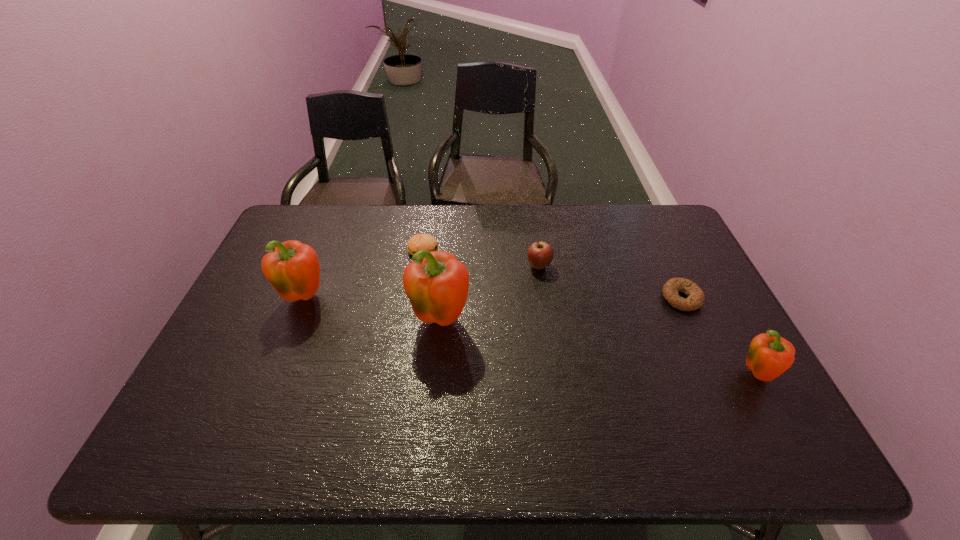
Find the location of `free area in between the second pepper from right to left and the bagel`. free area in between the second pepper from right to left and the bagel is located at coordinates (561, 309).

At what (x,y) coordinates should I click in order to perform the action: click on blank region between the shortest object and the leftmost object. Please return your answer as a coordinate pair (x, y). Looking at the image, I should click on (493, 298).

The width and height of the screenshot is (960, 540). Find the location of `vacant space that is in between the second pepper from left to right and the second tallest object`. vacant space that is in between the second pepper from left to right and the second tallest object is located at coordinates (372, 309).

The height and width of the screenshot is (540, 960). What are the coordinates of `empty space that is in between the third shortest object and the bagel` in the screenshot? It's located at (611, 282).

The image size is (960, 540). Identify the location of free space between the nearest pepper and the bagel. coord(720,337).

Select which object appears as the third closest to the bagel. Please provide its 2D coordinates. Your answer should be formatted as a tuple, i.e. [(x, y)], where the tuple contains the x and y coordinates of a point satisfying the conditions above.

[(436, 283)]

Choose which object is the nearest neighbor to the bagel. Please provide its 2D coordinates. Your answer should be formatted as a tuple, i.e. [(x, y)], where the tuple contains the x and y coordinates of a point satisfying the conditions above.

[(768, 357)]

Identify the location of pepper that is the closest one to the apple. (436, 283).

Select which pepper is the second closest to the leftmost object. Please provide its 2D coordinates. Your answer should be formatted as a tuple, i.e. [(x, y)], where the tuple contains the x and y coordinates of a point satisfying the conditions above.

[(768, 357)]

You are a GUI agent. You are given a task and a screenshot of the screen. Output one action in this format:
    pyautogui.click(x=<x>, y=<y>)
    Task: Click on the free space that satisfies the following two spatial constraints: 1. on the front side of the shortest object; 2. on the right side of the fourth tallest object
    The height and width of the screenshot is (540, 960).
    Given the screenshot: What is the action you would take?
    pyautogui.click(x=543, y=298)